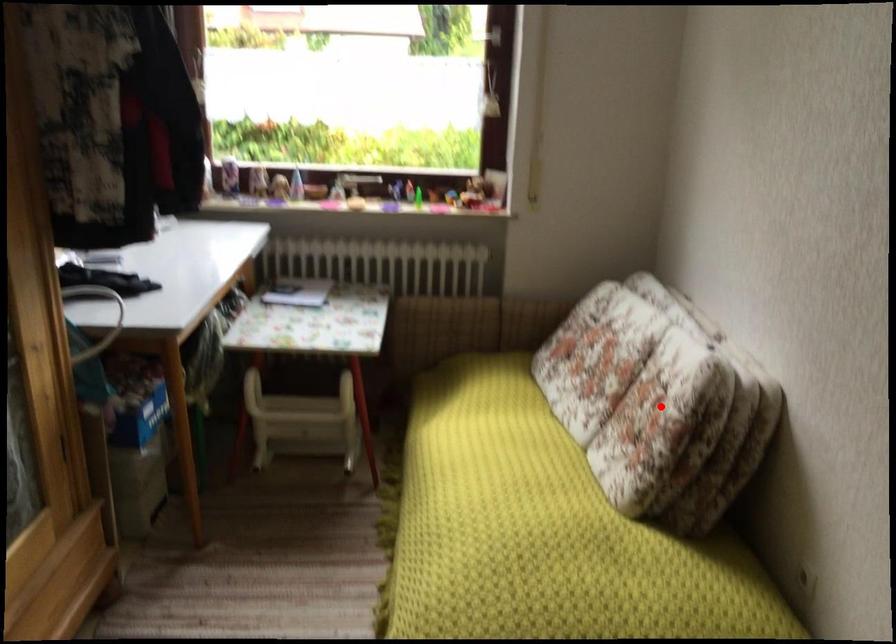
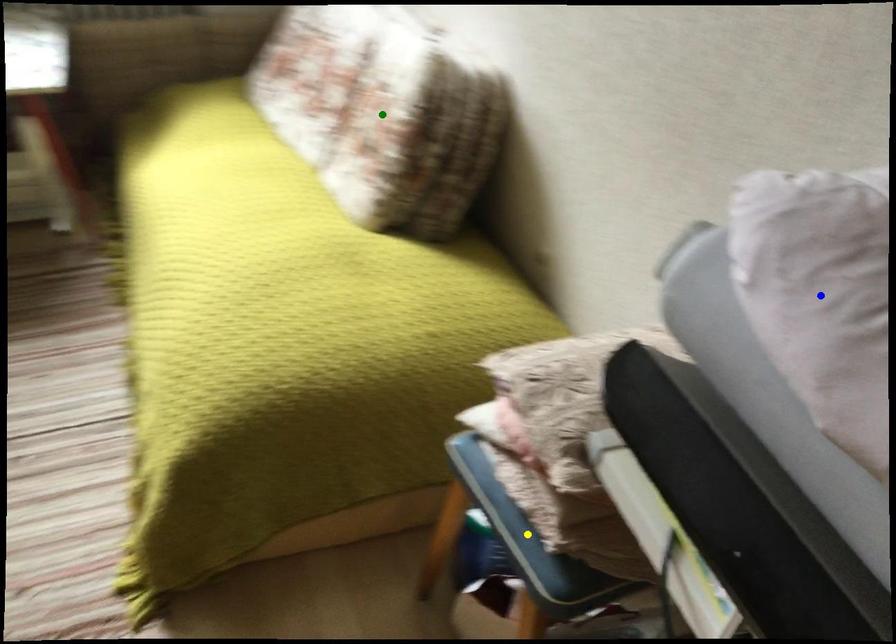
Question: I am providing you with two images of the same scene from different viewpoints. A red point is marked on the first image. You are given multiple points on the second image. Which point in image 2 represents the same 3d spot as the red point in image 1?

Choices:
 (A) green point
 (B) blue point
 (C) yellow point

Answer: (A)